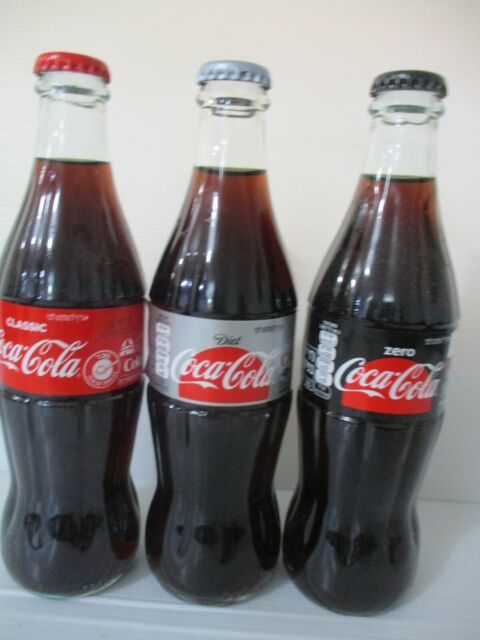
Where is `bottles`? bottles is located at coordinates (53, 461), (215, 463), (360, 454), (380, 371).